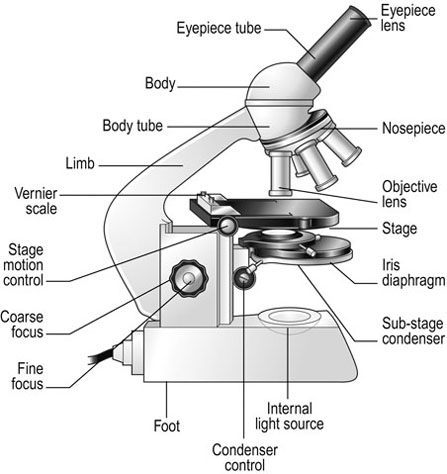
At what (x,y) coordinates should I click in order to perform the action: click on stage. Please return your answer as a coordinate pair (x, y). The height and width of the screenshot is (474, 447). Looking at the image, I should click on (328, 223).